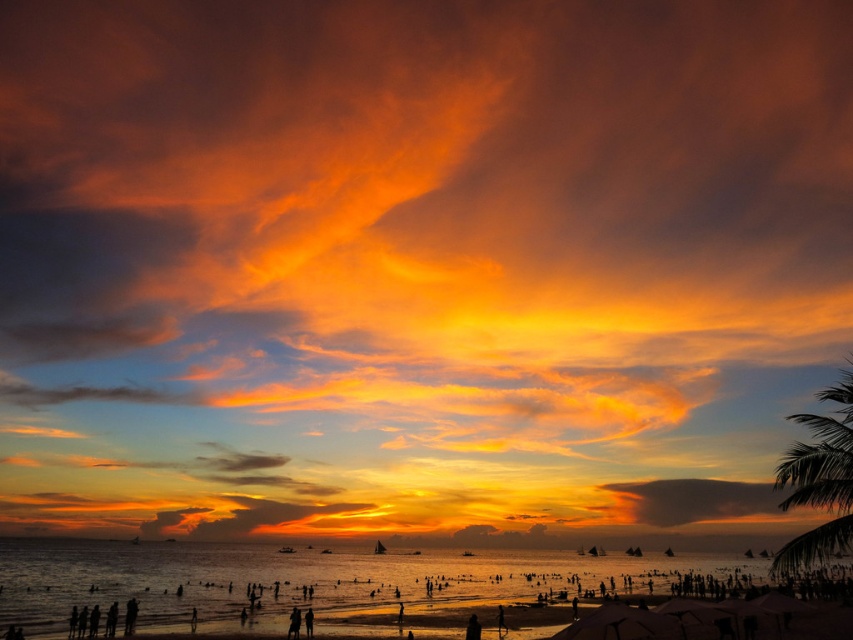
Who is positioned more to the left, translucent golden water at center or green leafy palm tree at right?

translucent golden water at center

Can you confirm if translucent golden water at center is taller than green leafy palm tree at right?

Yes.

Does point (189, 621) come behind point (840, 444)?

Yes, point (189, 621) is farther from viewer.

I want to click on translucent golden water at center, so click(x=329, y=588).

Does point (407, 624) come farther from viewer compared to point (712, 496)?

That is False.

Can you confirm if translucent golden water at center is bigger than matte orange cloud at lower right?

Correct, translucent golden water at center is larger in size than matte orange cloud at lower right.

Is point (236, 579) closer to camera compared to point (676, 522)?

That is True.

At what (x,y) coordinates should I click in order to perform the action: click on translucent golden water at center. Please return your answer as a coordinate pair (x, y). The width and height of the screenshot is (853, 640). Looking at the image, I should click on (329, 588).

The image size is (853, 640). Describe the element at coordinates (329, 588) in the screenshot. I see `translucent golden water at center` at that location.

Between point (798, 620) and point (257, 512), which one is positioned behind?

The point (257, 512) is behind.

Describe the element at coordinates (329, 588) in the screenshot. This screenshot has height=640, width=853. I see `translucent golden water at center` at that location.

The height and width of the screenshot is (640, 853). I want to click on translucent golden water at center, so click(x=329, y=588).